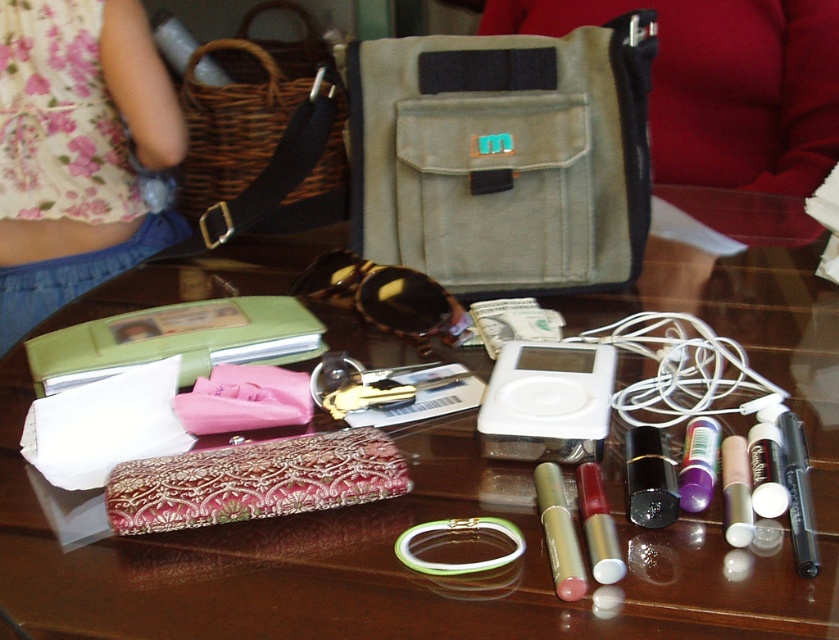
You are sitting at the table and want to reach for the purple glossy lipstick at center. Is the embroidered fabric pouch at center blocking your path to it?

The embroidered fabric pouch at center is in front of the purple glossy lipstick at center, so it is blocking the path to the lipstick.

You are sitting at the table and want to pick up the green wallet with a photo attached. Which point, point (467, 100) or point (97, 17), is closer to you?

Point (467, 100) is closer to the viewer than point (97, 17).

You are sitting at the table and want to place your phone between the olive green canvas pouch at center and the floral fabric dress at upper left. Which side should you place it on to be between them?

To place your phone between the olive green canvas pouch at center and the floral fabric dress at upper left, you should position it to the left of the olive green canvas pouch at center, as the floral fabric dress at upper left is to its left side.